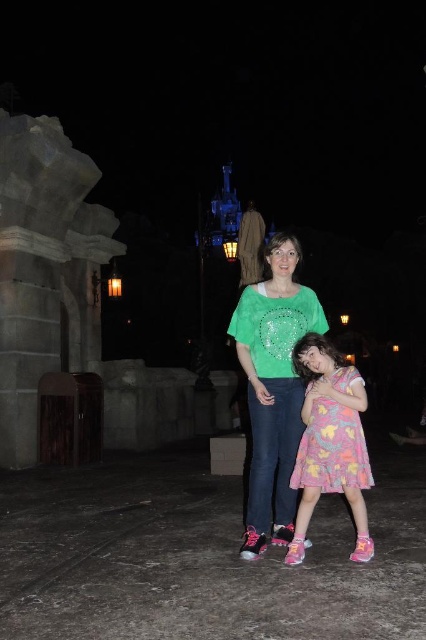
Is green glittery blouse at center wider than pastel floral dress at center?

Yes.

Does green glittery blouse at center come behind pastel floral dress at center?

Yes, it is.

Where is `green glittery blouse at center`? The width and height of the screenshot is (426, 640). green glittery blouse at center is located at coordinates (273, 388).